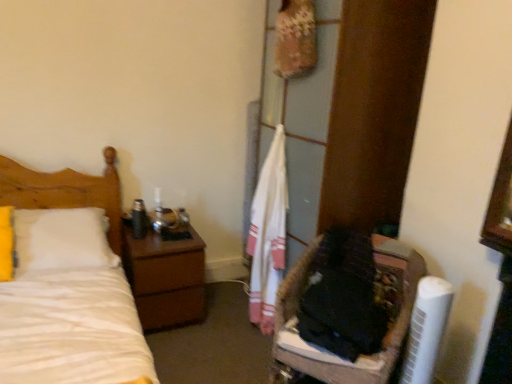
Identify the location of spots to the right of brown wood nightstand at left. The height and width of the screenshot is (384, 512). 224,319.